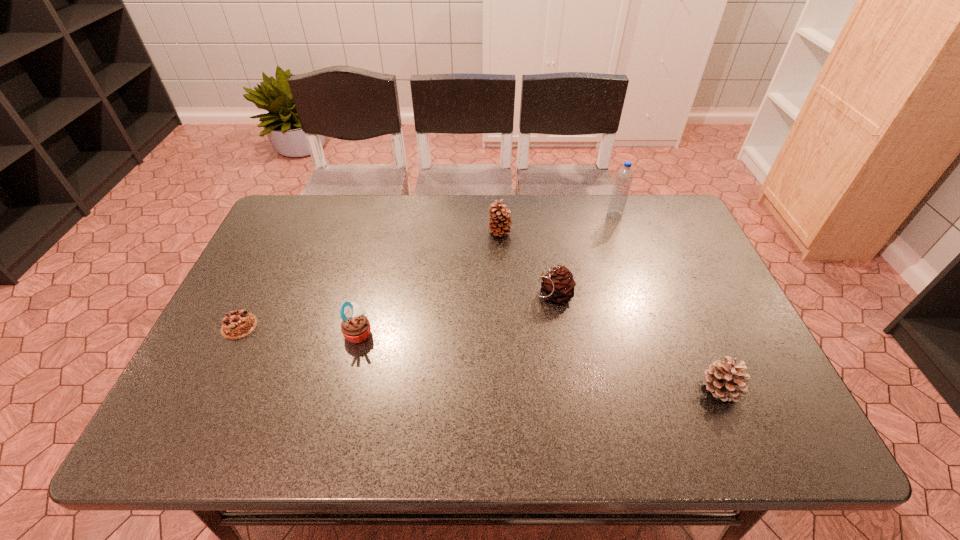
Find the location of a particular element. pinecone at the far edge is located at coordinates (500, 221).

This screenshot has width=960, height=540. What are the coordinates of `object present at the left edge` in the screenshot? It's located at (239, 323).

Identify the location of object positioned at the right edge. (725, 381).

Locate an element on the screen. This screenshot has height=540, width=960. free space at the far edge of the desktop is located at coordinates (349, 238).

Image resolution: width=960 pixels, height=540 pixels. Find the location of `vacant area at the near edge`. vacant area at the near edge is located at coordinates (604, 434).

Identify the location of free space at the left edge of the desktop. The width and height of the screenshot is (960, 540). (280, 319).

I want to click on vacant region at the right edge of the desktop, so click(x=681, y=340).

In the image, there is a desktop. Find the location of `free region at the far left corner`. free region at the far left corner is located at coordinates (297, 217).

Locate an element on the screen. The image size is (960, 540). free space at the near left corner is located at coordinates (170, 441).

In the image, there is a desktop. Where is `free space at the far right corner`? free space at the far right corner is located at coordinates (637, 210).